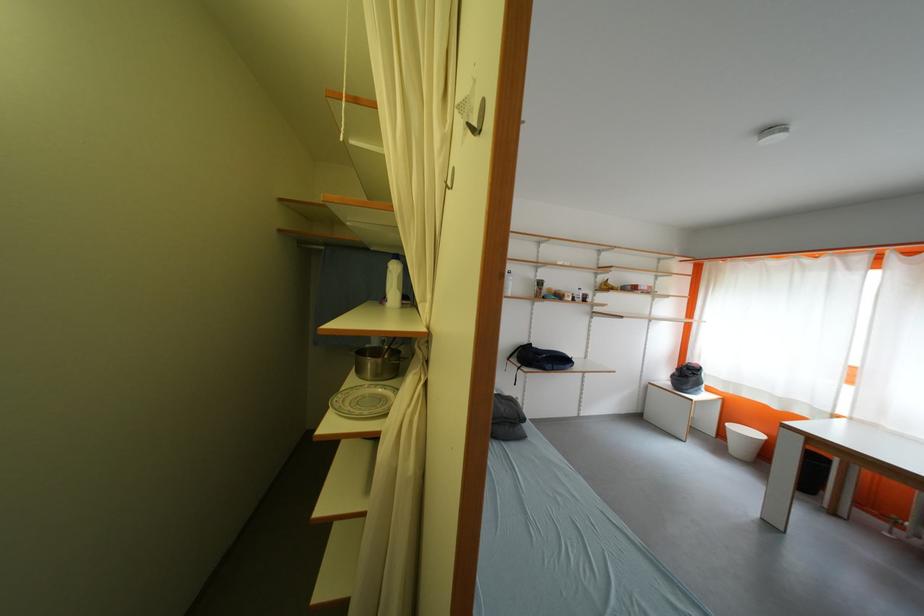
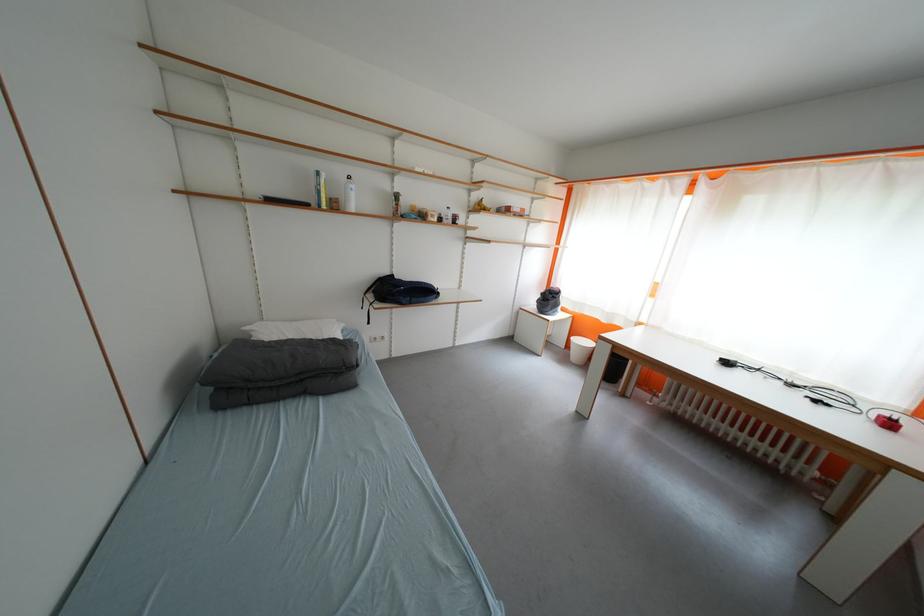
Find the pixel in the second image that matches point (602, 302) in the first image.

(476, 225)